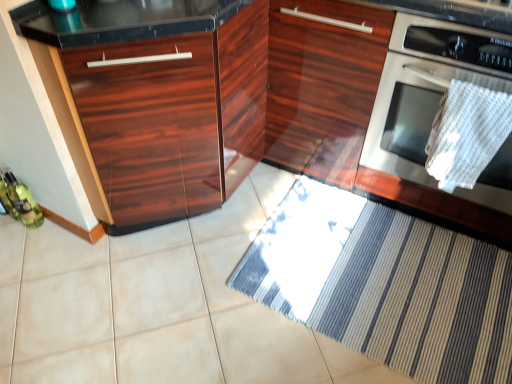
Question: Is white woven towel at right not close to glossy wood cabinet at center, positioned as the 1th cabinetry in right-to-left order?

Choices:
 (A) yes
 (B) no

Answer: (B)

Question: Can you confirm if white woven towel at right is bigger than glossy wood cabinet at center, the 2th cabinetry in the left-to-right sequence?

Choices:
 (A) no
 (B) yes

Answer: (A)

Question: Does white woven towel at right have a smaller size compared to glossy wood cabinet at center, positioned as the 1th cabinetry in right-to-left order?

Choices:
 (A) yes
 (B) no

Answer: (A)

Question: Does white woven towel at right touch glossy wood cabinet at center, the 2th cabinetry in the left-to-right sequence?

Choices:
 (A) yes
 (B) no

Answer: (B)

Question: From a real-world perspective, is white woven towel at right on top of glossy wood cabinet at center, positioned as the 1th cabinetry in right-to-left order?

Choices:
 (A) no
 (B) yes

Answer: (B)

Question: Is white woven towel at right wider than glossy wood cabinet at center, the 2th cabinetry in the left-to-right sequence?

Choices:
 (A) no
 (B) yes

Answer: (A)

Question: Could you tell me if white woven towel at right is turned towards striped fabric doormat at lower center?

Choices:
 (A) no
 (B) yes

Answer: (A)

Question: Can you confirm if white woven towel at right is shorter than striped fabric doormat at lower center?

Choices:
 (A) yes
 (B) no

Answer: (B)

Question: Is white woven towel at right smaller than striped fabric doormat at lower center?

Choices:
 (A) yes
 (B) no

Answer: (A)

Question: Can you confirm if white woven towel at right is wider than striped fabric doormat at lower center?

Choices:
 (A) no
 (B) yes

Answer: (A)

Question: Is white woven towel at right positioned behind striped fabric doormat at lower center?

Choices:
 (A) yes
 (B) no

Answer: (B)

Question: Considering the relative sizes of white woven towel at right and striped fabric doormat at lower center in the image provided, is white woven towel at right thinner than striped fabric doormat at lower center?

Choices:
 (A) yes
 (B) no

Answer: (A)

Question: Is glossy wood cabinet at left, which ranks as the second cabinetry in right-to-left order, thinner than striped fabric doormat at lower center?

Choices:
 (A) no
 (B) yes

Answer: (B)